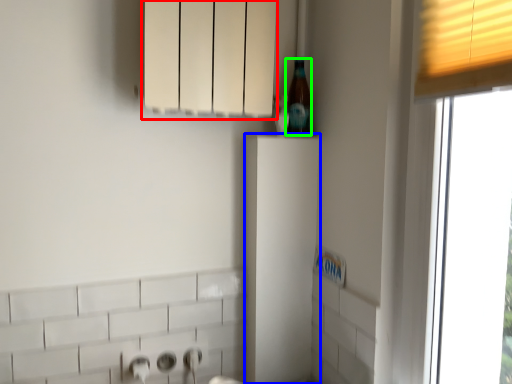
Question: Which object is positioned farthest from cabinetry (highlighted by a red box)? Select from cabinetry (highlighted by a blue box) and beer bottle (highlighted by a green box).

Choices:
 (A) cabinetry
 (B) beer bottle

Answer: (A)